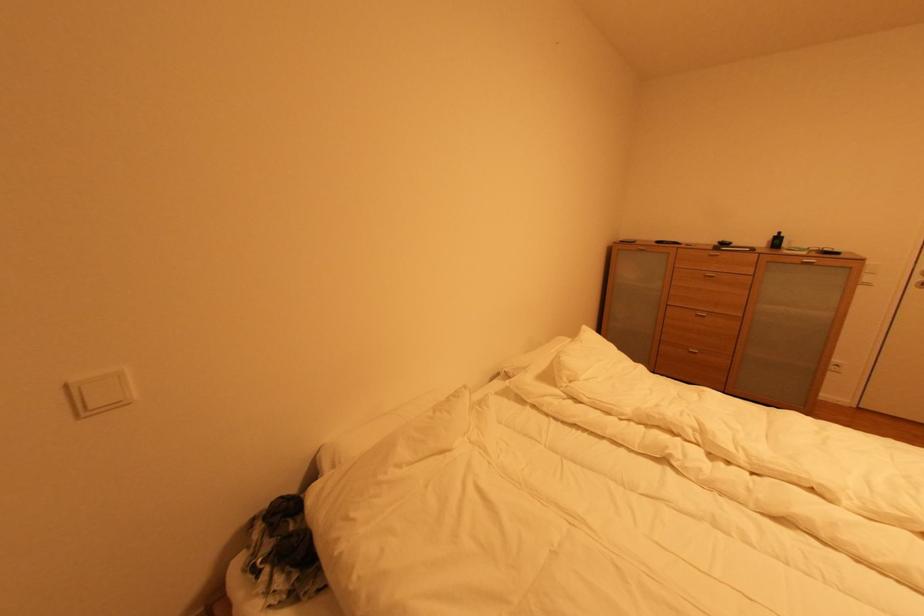
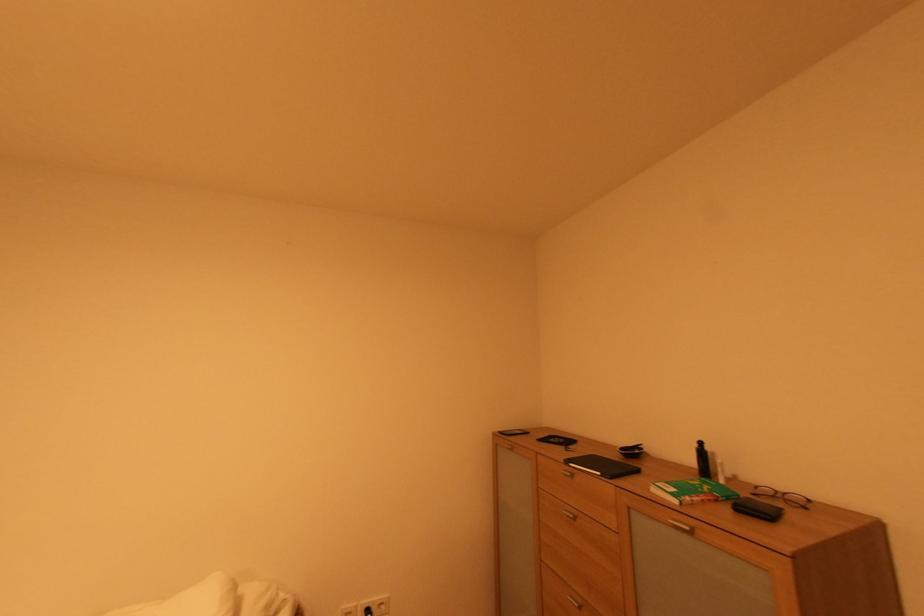
The point at (810, 254) is marked in the first image. Where is the corresponding point in the second image?

(682, 503)